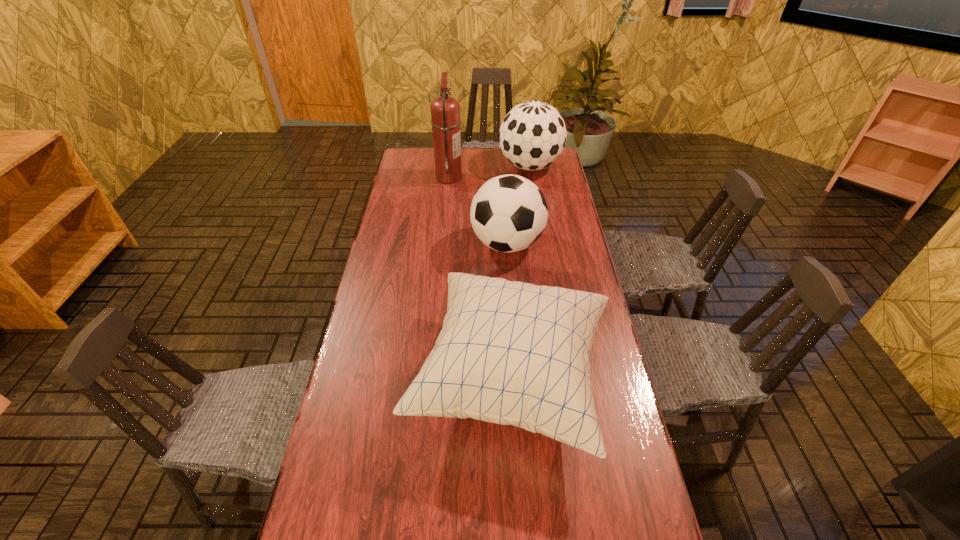
Identify the location of free spot that satisfies the following two spatial constraints: 1. on the front-facing side of the nearer soccer ball; 2. on the right side of the tallest object. (443, 244).

Locate an element on the screen. This screenshot has width=960, height=540. free point that satisfies the following two spatial constraints: 1. on the back side of the nearer soccer ball; 2. on the front-facing side of the fire extinguisher is located at coordinates (502, 177).

Locate an element on the screen. This screenshot has width=960, height=540. vacant region that satisfies the following two spatial constraints: 1. on the back side of the nearest object; 2. on the front-facing side of the tallest object is located at coordinates (499, 177).

Find the location of `free spot that satisfies the following two spatial constraints: 1. on the front side of the farther soccer ball; 2. on the front-facing side of the tallest object`. free spot that satisfies the following two spatial constraints: 1. on the front side of the farther soccer ball; 2. on the front-facing side of the tallest object is located at coordinates (532, 177).